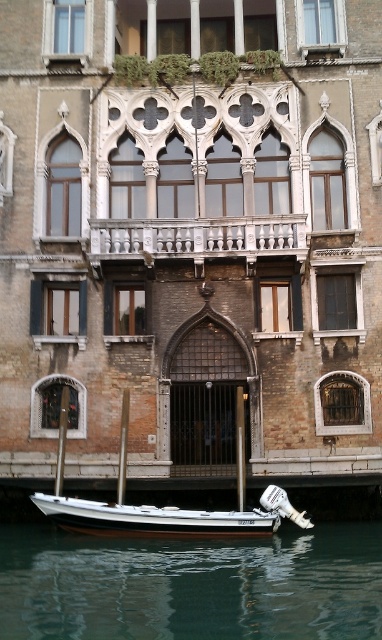
Is greenish water at lower center closer to the viewer compared to white stone railing at center?

Yes.

Is greenish water at lower center thinner than white stone railing at center?

No.

The height and width of the screenshot is (640, 382). What do you see at coordinates (192, 586) in the screenshot?
I see `greenish water at lower center` at bounding box center [192, 586].

This screenshot has width=382, height=640. In order to click on greenish water at lower center in this screenshot , I will do `click(192, 586)`.

Looking at this image, does greenish water at lower center have a smaller size compared to white polished wood boat at lower center?

Actually, greenish water at lower center might be larger than white polished wood boat at lower center.

Is the position of greenish water at lower center less distant than that of white polished wood boat at lower center?

That is True.

Is point (118, 637) farther from viewer compared to point (252, 509)?

That is False.

Image resolution: width=382 pixels, height=640 pixels. In order to click on greenish water at lower center in this screenshot , I will do `click(192, 586)`.

Is white stone railing at center below white polished wood boat at lower center?

Actually, white stone railing at center is above white polished wood boat at lower center.

Who is more forward, (x=140, y=244) or (x=294, y=524)?

Positioned in front is point (x=294, y=524).

I want to click on white stone railing at center, so click(x=197, y=240).